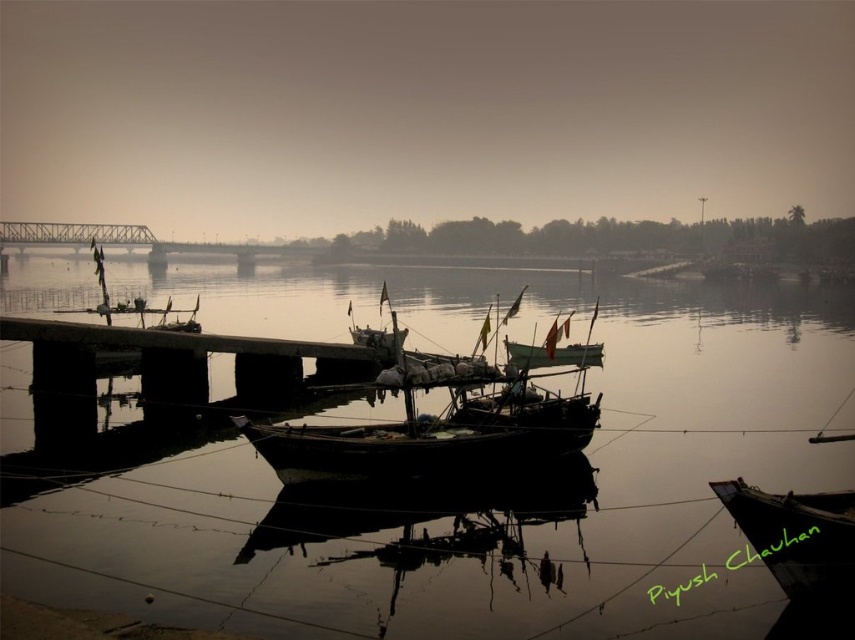
Question: Can you confirm if dark brown wooden boat at lower right is smaller than green matte boat at center?

Choices:
 (A) yes
 (B) no

Answer: (A)

Question: Which of the following is the farthest from the observer?

Choices:
 (A) (492, 464)
 (B) (198, 552)

Answer: (A)

Question: Can you confirm if dark brown wooden boat at lower right is bigger than green matte boat at center?

Choices:
 (A) no
 (B) yes

Answer: (A)

Question: Which object appears closest to the camera in this image?

Choices:
 (A) dark brown wooden boat at lower right
 (B) green matte boat at center
 (C) wooden boat at center

Answer: (A)

Question: Is wooden boat at center smaller than green matte boat at center?

Choices:
 (A) yes
 (B) no

Answer: (B)

Question: Which point appears farthest from the camera in this image?

Choices:
 (A) (836, 529)
 (B) (705, 618)
 (C) (304, 452)
 (D) (564, 320)

Answer: (D)